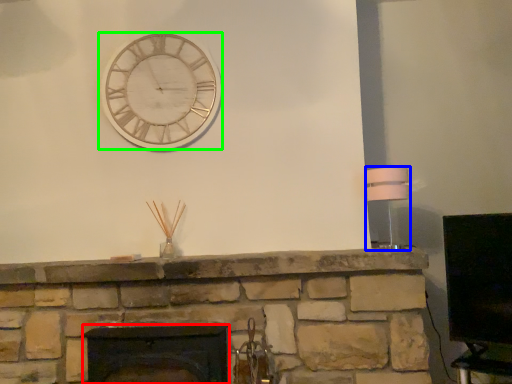
Question: Considering the real-world distances, which object is farthest from fireplace (highlighted by a red box)? lamp (highlighted by a blue box) or wall clock (highlighted by a green box)?

Choices:
 (A) lamp
 (B) wall clock

Answer: (A)